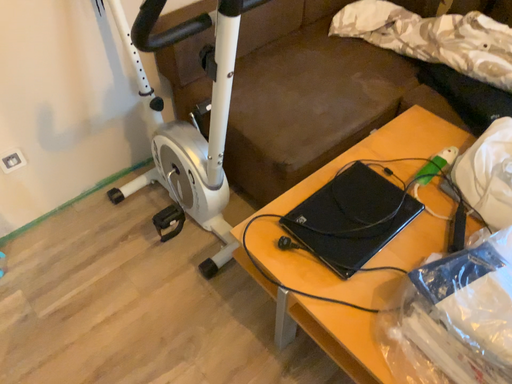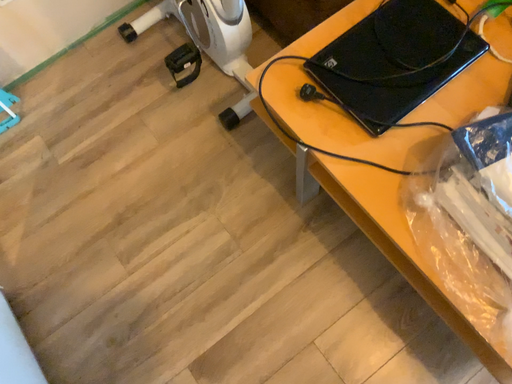
Question: Which way did the camera rotate in the video?

Choices:
 (A) rotated downward
 (B) rotated upward

Answer: (A)